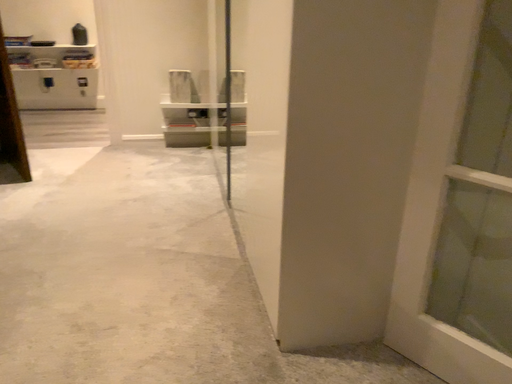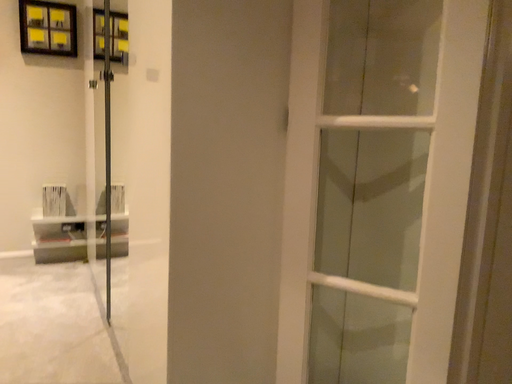
Question: Which way did the camera rotate in the video?

Choices:
 (A) rotated upward
 (B) rotated downward

Answer: (A)